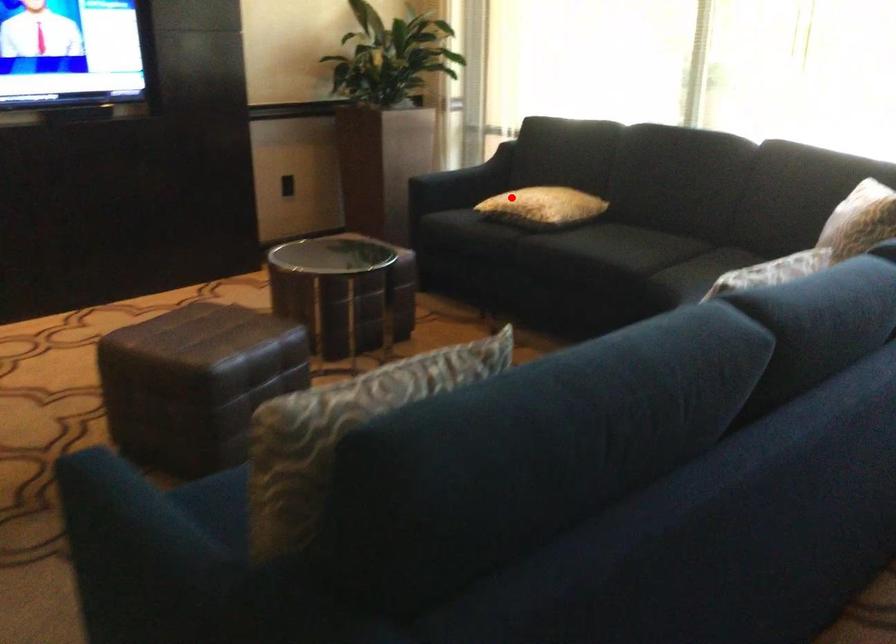
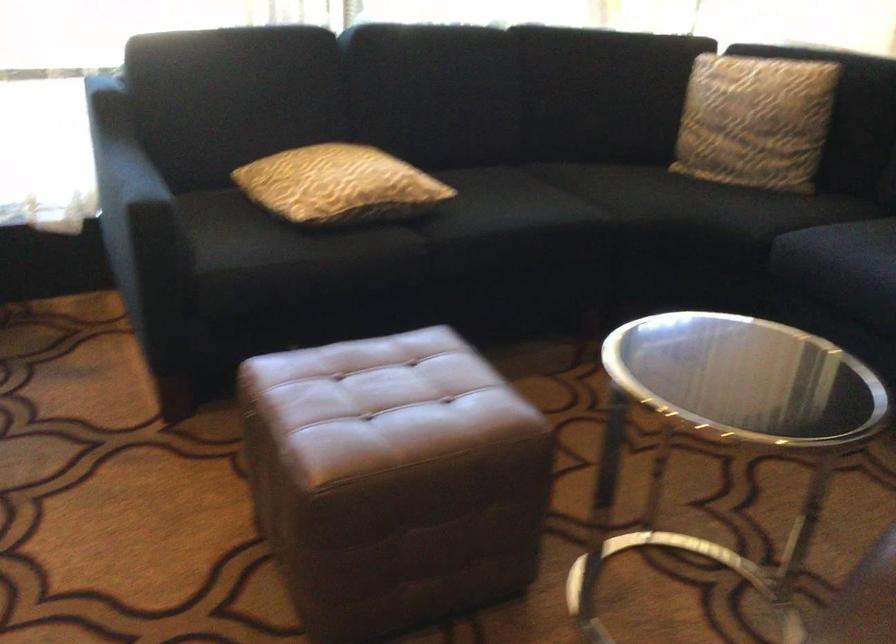
Locate, in the second image, the point that corresponds to the highlighted location in the first image.

(339, 185)